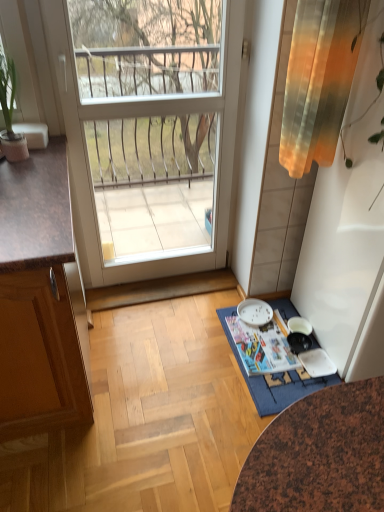
Question: Should I look upward or downward to see green leafy plant in pot at left?

Choices:
 (A) down
 (B) up

Answer: (B)

Question: From the image's perspective, would you say blue fabric doormat at lower center is shown under white glossy door at center?

Choices:
 (A) yes
 (B) no

Answer: (A)

Question: Can you confirm if blue fabric doormat at lower center is smaller than white glossy door at center?

Choices:
 (A) no
 (B) yes

Answer: (B)

Question: Could white glossy door at center be considered to be inside blue fabric doormat at lower center?

Choices:
 (A) yes
 (B) no

Answer: (B)

Question: From the image's perspective, is blue fabric doormat at lower center on white glossy door at center?

Choices:
 (A) yes
 (B) no

Answer: (B)

Question: From a real-world perspective, is blue fabric doormat at lower center below white glossy door at center?

Choices:
 (A) no
 (B) yes

Answer: (B)

Question: Is blue fabric doormat at lower center at the left side of white glossy door at center?

Choices:
 (A) no
 (B) yes

Answer: (A)

Question: From the image's perspective, is blue fabric doormat at lower center on top of gradient fabric curtain at upper right?

Choices:
 (A) yes
 (B) no

Answer: (B)

Question: Is blue fabric doormat at lower center wider than gradient fabric curtain at upper right?

Choices:
 (A) yes
 (B) no

Answer: (A)

Question: Can you confirm if blue fabric doormat at lower center is bigger than gradient fabric curtain at upper right?

Choices:
 (A) no
 (B) yes

Answer: (A)

Question: Is blue fabric doormat at lower center next to gradient fabric curtain at upper right?

Choices:
 (A) no
 (B) yes

Answer: (A)

Question: Is blue fabric doormat at lower center at the left side of gradient fabric curtain at upper right?

Choices:
 (A) no
 (B) yes

Answer: (B)

Question: Is there a large distance between blue fabric doormat at lower center and gradient fabric curtain at upper right?

Choices:
 (A) no
 (B) yes

Answer: (B)

Question: Does white glossy door at center touch gradient fabric curtain at upper right?

Choices:
 (A) no
 (B) yes

Answer: (A)